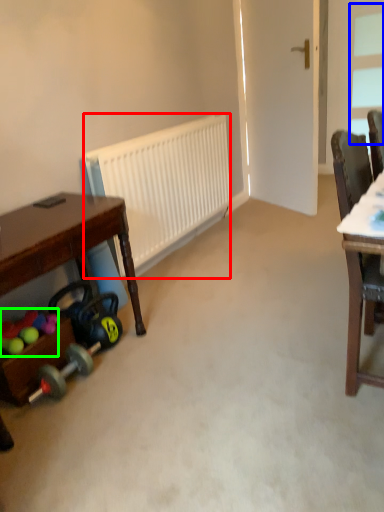
Question: Which is farther away from radiator (highlighted by a red box)? window (highlighted by a blue box) or toy (highlighted by a green box)?

Choices:
 (A) window
 (B) toy

Answer: (A)